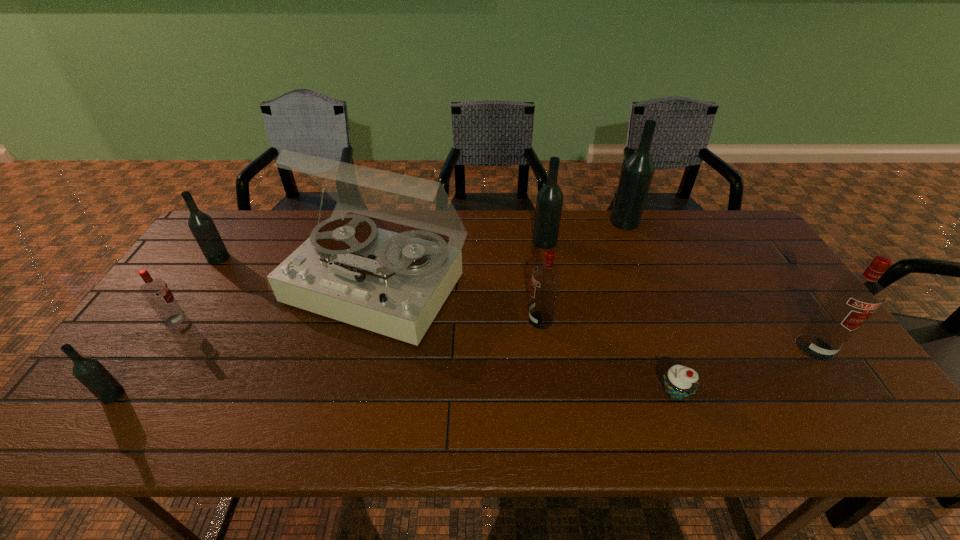
Where is `free space that satisfies the following two spatial constraints: 1. on the back side of the cupcake; 2. on the front label of the leftmost red vodka`? The width and height of the screenshot is (960, 540). free space that satisfies the following two spatial constraints: 1. on the back side of the cupcake; 2. on the front label of the leftmost red vodka is located at coordinates (649, 320).